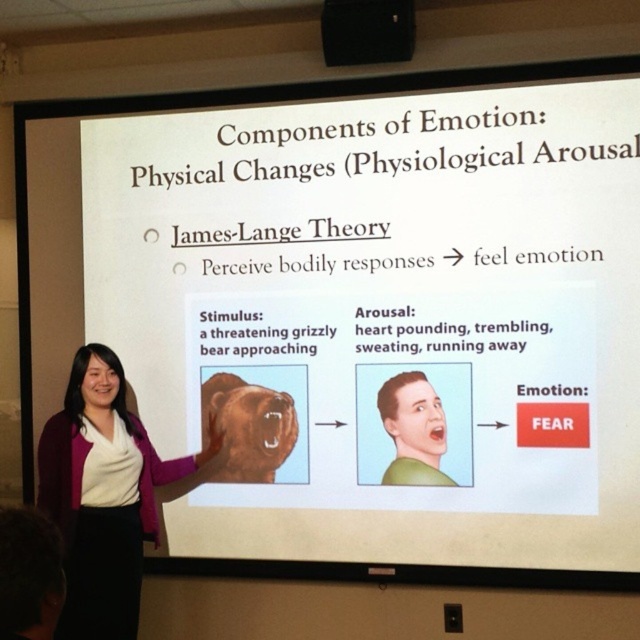
You are an attendee at the presentation and notice two objects on the slide. Which object takes up more space on the slide between the green matte face at center and the black plastic projector at upper center?

The black plastic projector at upper center takes up more space on the slide than the green matte face at center.

You are an AI assistant helping a student prepare for a psychology exam. The student asks if the distance between the matte purple sweater at center and the green matte face at center on the slide is enough for a person to comfortably read the text on the sweater from the face position. The average comfortable reading distance for text is 14 inches. Can you confirm?

The distance between the matte purple sweater at center and the green matte face at center is 3.50 feet, which is equivalent to 42 inches. Since the average comfortable reading distance is 14 inches, the distance is more than enough for comfortable reading.

You are a student sitting in the front row of the classroom. You notice two objects on the slide at center. Which one is taller between the matte purple sweater at center and the green matte face at center?

The matte purple sweater at center is taller than the green matte face at center according to the slide.